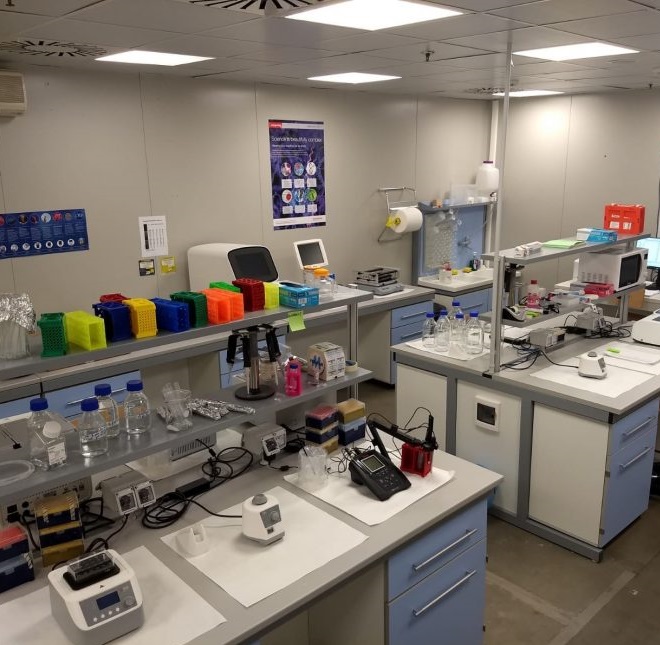
Find the location of a particular element. The width and height of the screenshot is (660, 645). ceiling lights is located at coordinates (169, 70), (337, 79), (523, 93).